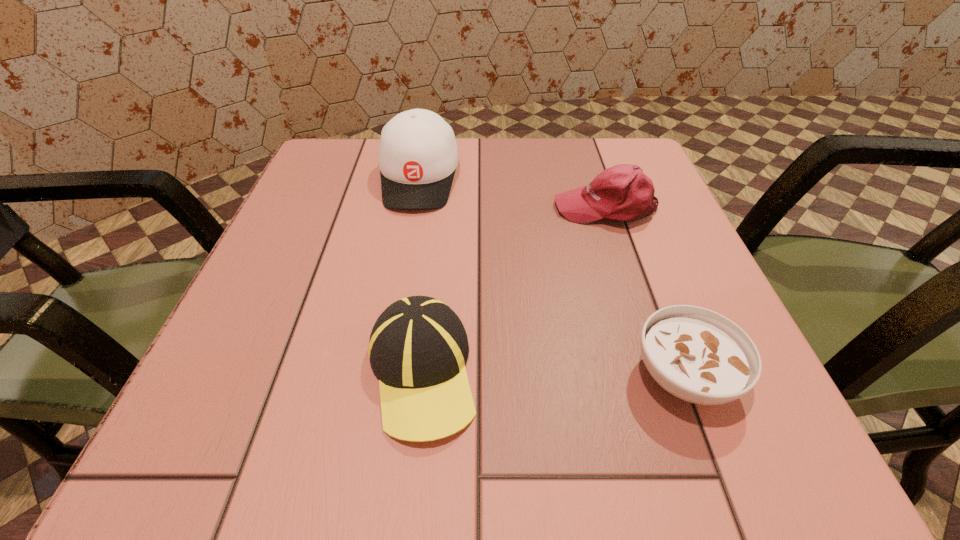
I want to click on soup bowl that is at the near edge, so click(697, 355).

I want to click on object that is at the left edge, so click(x=418, y=155).

Locate an element on the screen. baseball cap that is at the right edge is located at coordinates (623, 192).

The image size is (960, 540). What are the coordinates of `soup bowl at the right edge` in the screenshot? It's located at (697, 355).

Identify the location of object that is positioned at the far left corner. pyautogui.click(x=418, y=155).

At what (x,y) coordinates should I click in order to perform the action: click on object at the far right corner. Please return your answer as a coordinate pair (x, y). Image resolution: width=960 pixels, height=540 pixels. Looking at the image, I should click on (623, 192).

I want to click on object that is at the near right corner, so click(697, 355).

Identify the location of vacant position at the far edge of the desktop. This screenshot has width=960, height=540. (540, 176).

The image size is (960, 540). Find the location of `vacant space at the near edge of the desktop`. vacant space at the near edge of the desktop is located at coordinates (548, 422).

At what (x,y) coordinates should I click in order to perform the action: click on free space at the left edge of the desktop. Please return your answer as a coordinate pair (x, y). Looking at the image, I should click on tap(316, 363).